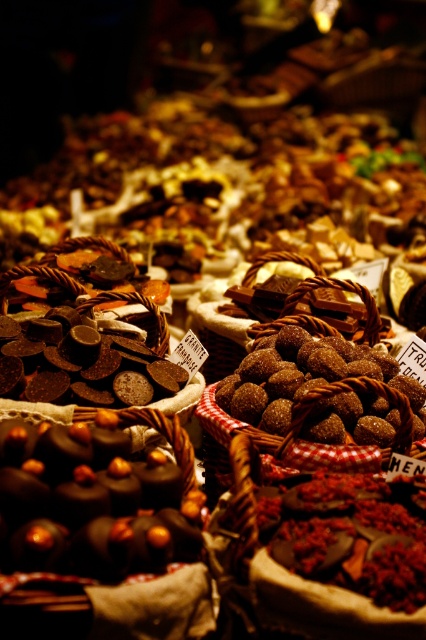
The width and height of the screenshot is (426, 640). I want to click on shiny dark chocolate truffles at center, so click(97, 497).

The height and width of the screenshot is (640, 426). What do you see at coordinates (97, 497) in the screenshot?
I see `shiny dark chocolate truffles at center` at bounding box center [97, 497].

Locate an element on the screen. The width and height of the screenshot is (426, 640). shiny dark chocolate truffles at center is located at coordinates (97, 497).

The height and width of the screenshot is (640, 426). I want to click on shiny dark chocolate truffles at center, so click(x=97, y=497).

Is point (5, 440) farther from camera compared to point (385, 404)?

No, it is not.

At what (x,y) coordinates should I click in order to perform the action: click on shiny dark chocolate truffles at center. Please return your answer as a coordinate pair (x, y). Looking at the image, I should click on (97, 497).

Looking at this image, between chocolate-coated nuts at center and sugared chocolate at center, which one appears on the left side from the viewer's perspective?

Positioned to the left is sugared chocolate at center.

Does chocolate-coated nuts at center appear over sugared chocolate at center?

No, chocolate-coated nuts at center is not above sugared chocolate at center.

Who is more forward, [393,509] or [195,308]?

Point [393,509] is in front.

Locate an element on the screen. Image resolution: width=426 pixels, height=640 pixels. chocolate-coated nuts at center is located at coordinates (348, 536).